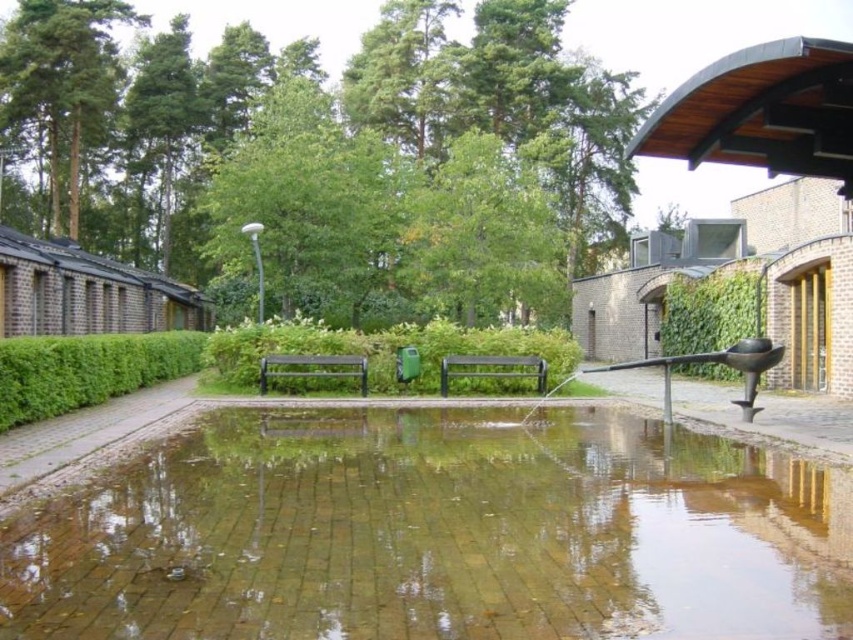
Question: Can you confirm if green leafy tree at upper center is bigger than green painted wood park bench at center?

Choices:
 (A) no
 (B) yes

Answer: (B)

Question: Among these points, which one is nearest to the camera?

Choices:
 (A) (366, 337)
 (B) (131, 400)
 (C) (320, 278)
 (D) (721, 404)

Answer: (D)

Question: Does clear water at center appear on the left side of green leafy hedge at left?

Choices:
 (A) no
 (B) yes

Answer: (A)

Question: Which of the following is the farthest from the observer?

Choices:
 (A) (57, 131)
 (B) (169, 412)
 (C) (491, 364)

Answer: (A)

Question: Among these points, which one is nearest to the camera?

Choices:
 (A) (618, 115)
 (B) (706, 330)

Answer: (B)

Question: Does green leafy tree at upper left have a larger size compared to black polished water at center?

Choices:
 (A) no
 (B) yes

Answer: (B)